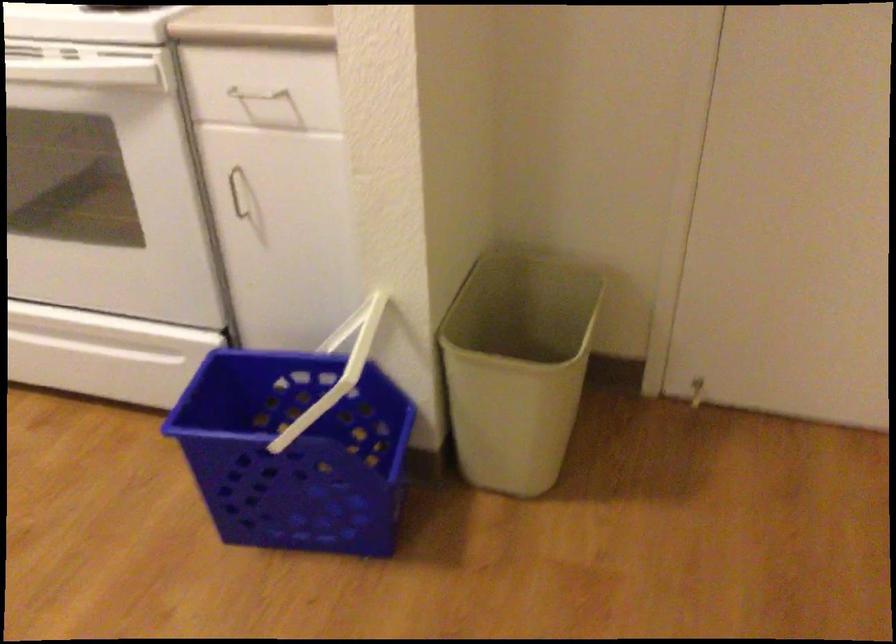
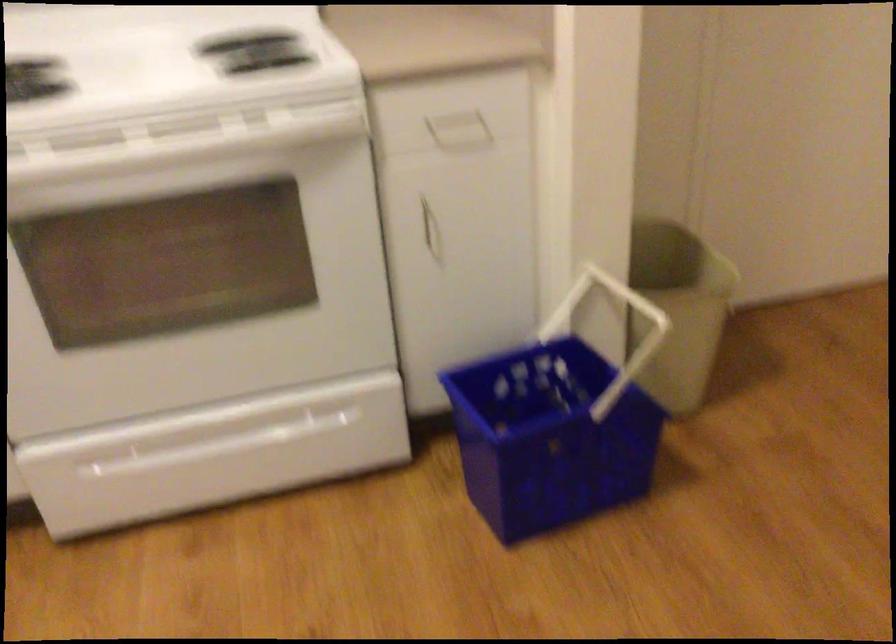
In the second image, find the point that corresponds to [83,346] in the first image.

(233, 440)